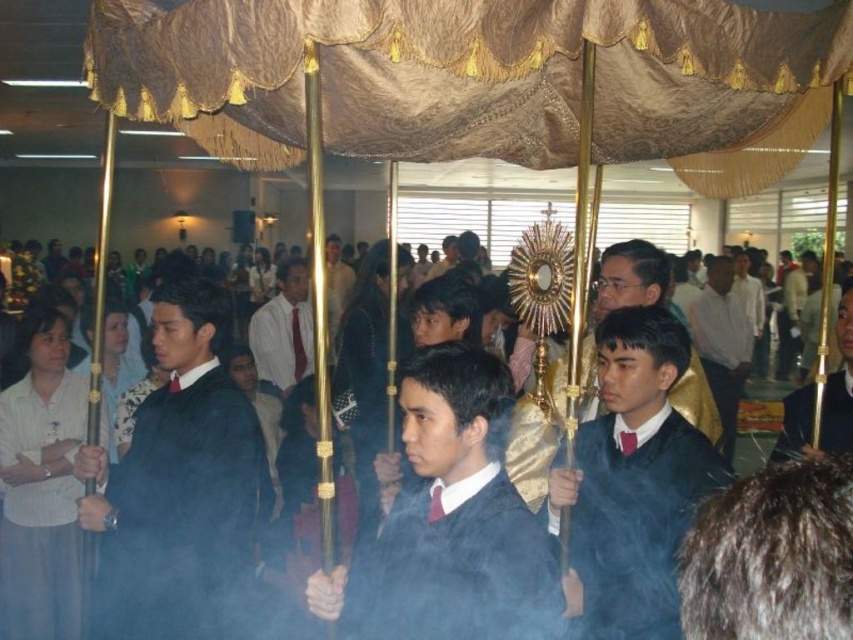
You are a photographer attending the religious procession. You want to capture a photo that includes both the brown fabric canopy at upper center and the black matte robe at center. Based on their positions, which object should appear higher in the photo?

The brown fabric canopy at upper center should appear higher in the photo because it is located above the black matte robe at center.

You are an attendee at the religious procession. You notice the black matte robe at center and the matte gold staff at center. Which object is closer to you from your perspective?

The black matte robe at center is closer to you because the matte gold staff at center is positioned behind it.

You are a photographer attending the religious procession and want to capture a clear shot of both the brown fabric canopy at upper center and the black matte robe at center. However, the incense smoke is causing some visibility issues. Based on their positions, which object should you focus on first to ensure both are in focus?

The brown fabric canopy at upper center is in front of the black matte robe at center, so you should focus on the brown fabric canopy at upper center first to ensure both are in focus.